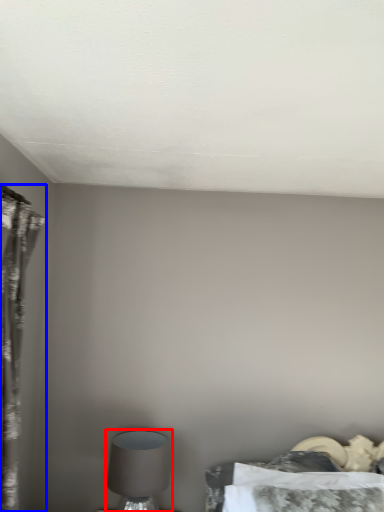
Question: Which of the following is the farthest to the observer, table lamp (highlighted by a red box) or curtain (highlighted by a blue box)?

Choices:
 (A) table lamp
 (B) curtain

Answer: (A)